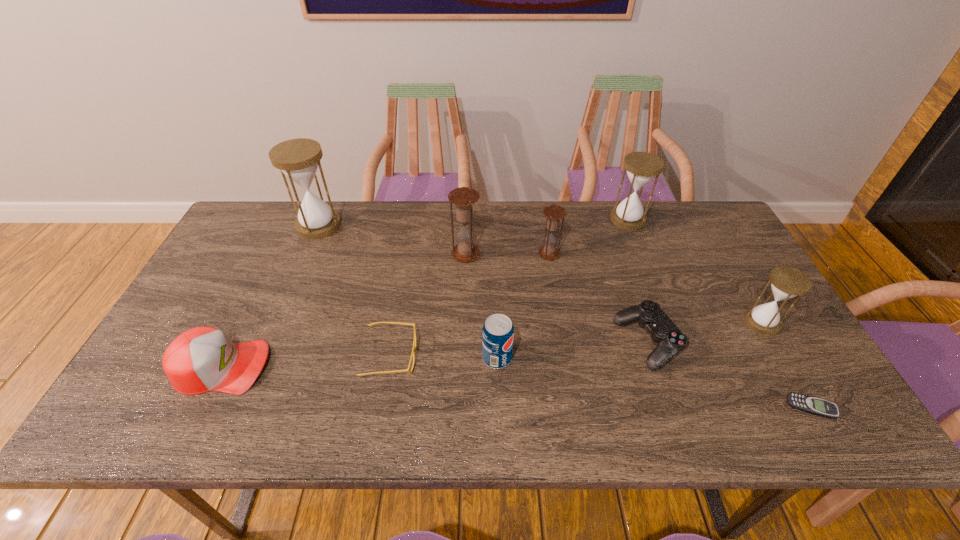
Find the location of a particular element. pop is located at coordinates (498, 332).

Locate an element on the screen. The image size is (960, 540). blue pop is located at coordinates (x=498, y=332).

Where is `baseball cap`? Image resolution: width=960 pixels, height=540 pixels. baseball cap is located at coordinates (202, 359).

This screenshot has height=540, width=960. Identify the location of red baseball cap. (202, 359).

The width and height of the screenshot is (960, 540). What are the coordinates of `the eighth tallest object` in the screenshot? It's located at (670, 339).

Image resolution: width=960 pixels, height=540 pixels. Identify the location of black control. (670, 339).

Where is `the second shortest object`? Image resolution: width=960 pixels, height=540 pixels. the second shortest object is located at coordinates (414, 342).

You are a GUI agent. You are given a task and a screenshot of the screen. Output one action in this format:
    pyautogui.click(x=<x>, y=<y>)
    Task: Click on the spectacles
    
    Given the screenshot: What is the action you would take?
    pyautogui.click(x=414, y=342)

Where is `gray beeper`? The height and width of the screenshot is (540, 960). gray beeper is located at coordinates (820, 407).

Find the location of a particular element. the shortest object is located at coordinates (820, 407).